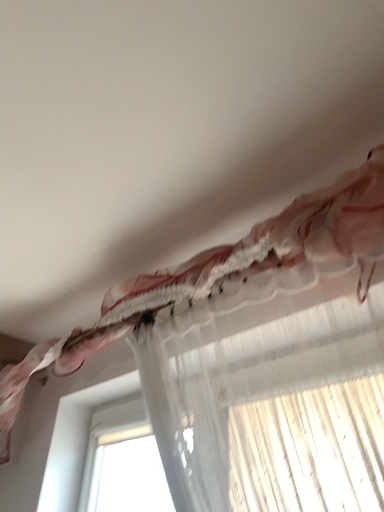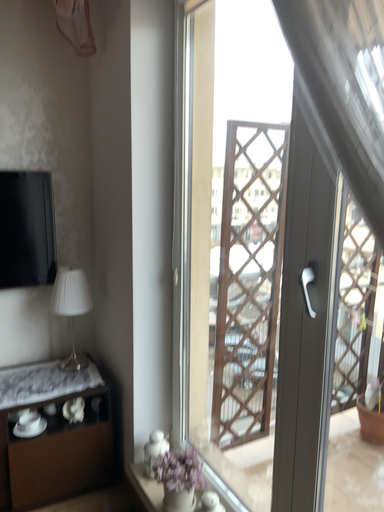
Question: How did the camera likely rotate when shooting the video?

Choices:
 (A) rotated left
 (B) rotated right

Answer: (A)